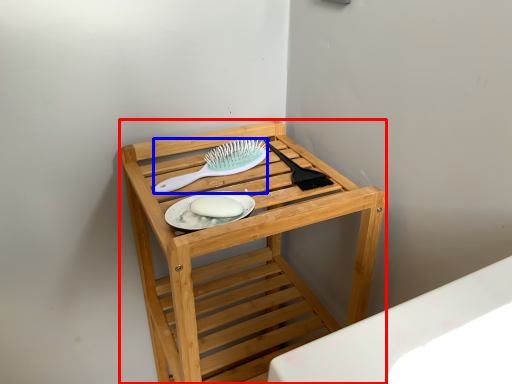
Question: Which point is further to the camera, furniture (highlighted by a red box) or brush (highlighted by a blue box)?

Choices:
 (A) furniture
 (B) brush

Answer: (B)